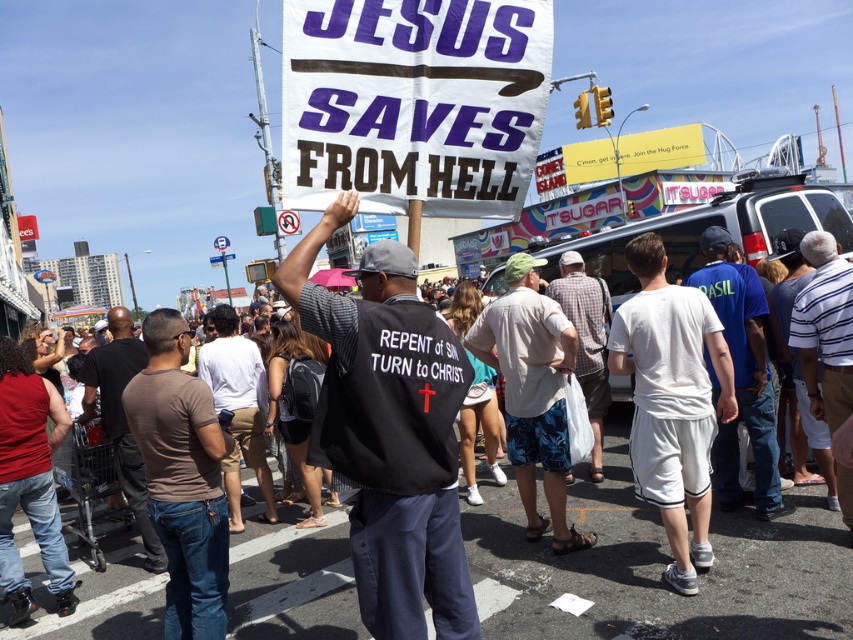
Which is below, white striped shirt at center or white cotton shirt at center?

white cotton shirt at center is below.

What do you see at coordinates (824, 330) in the screenshot?
I see `white striped shirt at center` at bounding box center [824, 330].

Who is more forward, (831, 342) or (268, 474)?

Point (831, 342) is more forward.

At what (x,y) coordinates should I click in order to perform the action: click on white striped shirt at center. Please return your answer as a coordinate pair (x, y). Looking at the image, I should click on (824, 330).

Can you confirm if blue jersey at center-right is wider than plaid fabric shirt at center?

Indeed, blue jersey at center-right has a greater width compared to plaid fabric shirt at center.

Is blue jersey at center-right bigger than plaid fabric shirt at center?

Incorrect, blue jersey at center-right is not larger than plaid fabric shirt at center.

This screenshot has height=640, width=853. What are the coordinates of `blue jersey at center-right` in the screenshot? It's located at (741, 378).

Where is `blue jersey at center-right`? Image resolution: width=853 pixels, height=640 pixels. blue jersey at center-right is located at coordinates (741, 378).

Who is higher up, black fabric jacket at center or white striped shirt at center?

white striped shirt at center is above.

Which of these two, black fabric jacket at center or white striped shirt at center, stands taller?

black fabric jacket at center

I want to click on black fabric jacket at center, so click(x=422, y=435).

The width and height of the screenshot is (853, 640). In order to click on black fabric jacket at center in this screenshot , I will do (x=422, y=435).